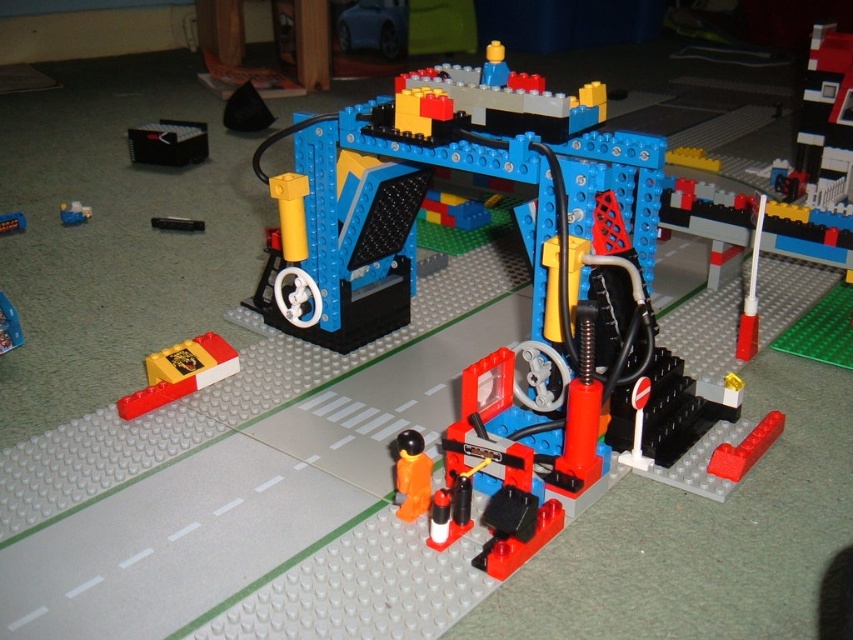
Question: Observing the image, what is the correct spatial positioning of brick-like plastic at lower left in reference to orange matte figure at center?

Choices:
 (A) right
 (B) left

Answer: (B)

Question: Which of the following is the closest to the observer?

Choices:
 (A) (67, 225)
 (B) (178, 396)
 (C) (4, 232)
 (D) (399, 502)

Answer: (D)

Question: Does brick-like plastic at lower left have a smaller size compared to orange matte figure at center?

Choices:
 (A) yes
 (B) no

Answer: (B)

Question: Which is nearer to the orange matte figure at center?

Choices:
 (A) brick-like plastic at lower left
 (B) smooth plastic brick at center
 (C) blue plastic brick at center

Answer: (A)

Question: Does brick-like plastic at lower left appear on the left side of smooth plastic brick at center?

Choices:
 (A) yes
 (B) no

Answer: (B)

Question: Which object appears closest to the camera in this image?

Choices:
 (A) orange matte figure at center
 (B) smooth plastic brick at center
 (C) blue plastic brick at center
 (D) brick-like plastic at lower left

Answer: (A)